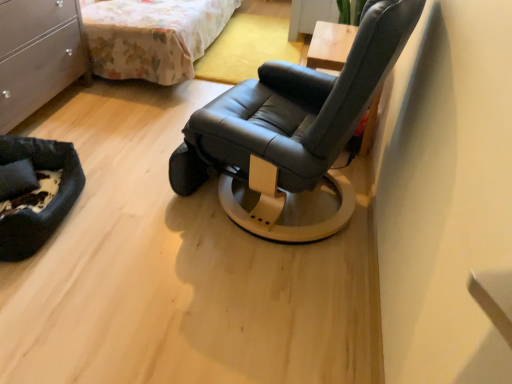
Question: From the image's perspective, is floral fabric bed at upper left under black leather chair at center?

Choices:
 (A) no
 (B) yes

Answer: (A)

Question: Is black leather chair at center at the back of floral fabric bed at upper left?

Choices:
 (A) yes
 (B) no

Answer: (B)

Question: Is floral fabric bed at upper left to the left of black leather chair at center from the viewer's perspective?

Choices:
 (A) yes
 (B) no

Answer: (A)

Question: Is floral fabric bed at upper left completely or partially outside of black leather chair at center?

Choices:
 (A) no
 (B) yes

Answer: (B)

Question: Does floral fabric bed at upper left lie in front of black leather chair at center?

Choices:
 (A) yes
 (B) no

Answer: (B)

Question: Considering the positions of black fabric pet bed at lower left and floral fabric bed at upper left in the image, is black fabric pet bed at lower left taller or shorter than floral fabric bed at upper left?

Choices:
 (A) short
 (B) tall

Answer: (A)

Question: Considering the positions of black fabric pet bed at lower left and floral fabric bed at upper left in the image, is black fabric pet bed at lower left wider or thinner than floral fabric bed at upper left?

Choices:
 (A) wide
 (B) thin

Answer: (B)

Question: Would you say black fabric pet bed at lower left is inside or outside floral fabric bed at upper left?

Choices:
 (A) inside
 (B) outside

Answer: (B)

Question: From the image's perspective, is black fabric pet bed at lower left above or below floral fabric bed at upper left?

Choices:
 (A) below
 (B) above

Answer: (A)

Question: In terms of size, does black fabric pet bed at lower left appear bigger or smaller than matte white dresser at left?

Choices:
 (A) big
 (B) small

Answer: (B)

Question: In terms of height, does black fabric pet bed at lower left look taller or shorter compared to matte white dresser at left?

Choices:
 (A) short
 (B) tall

Answer: (A)

Question: Is black fabric pet bed at lower left inside the boundaries of matte white dresser at left, or outside?

Choices:
 (A) outside
 (B) inside

Answer: (A)

Question: Considering the positions of black fabric pet bed at lower left and matte white dresser at left in the image, is black fabric pet bed at lower left wider or thinner than matte white dresser at left?

Choices:
 (A) wide
 (B) thin

Answer: (B)

Question: From the image's perspective, relative to matte white dresser at left, is black fabric pillow at lower left above or below?

Choices:
 (A) below
 (B) above

Answer: (A)

Question: Is black fabric pillow at lower left taller or shorter than matte white dresser at left?

Choices:
 (A) short
 (B) tall

Answer: (A)